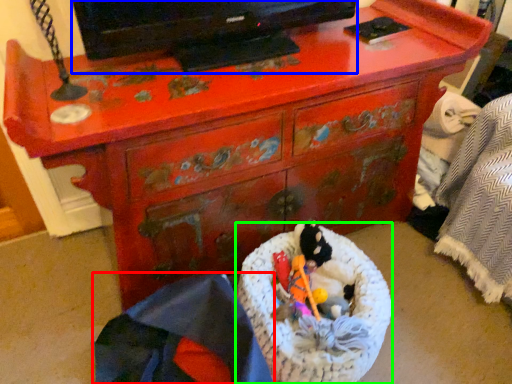
Question: Which is nearer to the material (highlighted by a red box)? television (highlighted by a blue box) or laundry basket (highlighted by a green box).

Choices:
 (A) television
 (B) laundry basket

Answer: (B)